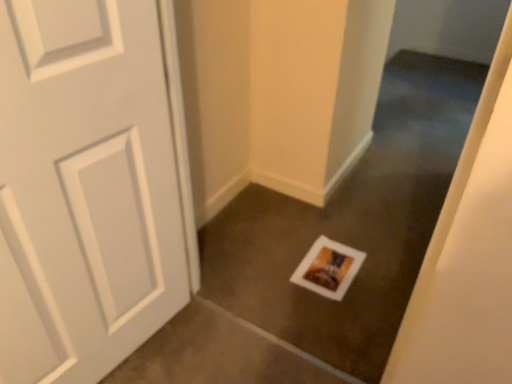
Question: Considering the positions of point (333, 291) and point (353, 205), is point (333, 291) closer or farther from the camera than point (353, 205)?

Choices:
 (A) closer
 (B) farther

Answer: (A)

Question: Considering the relative positions of white matte postcard at center and white matte picture frame at center in the image provided, is white matte postcard at center to the left or to the right of white matte picture frame at center?

Choices:
 (A) left
 (B) right

Answer: (B)

Question: In the image, is white matte postcard at center positioned in front of or behind white matte picture frame at center?

Choices:
 (A) behind
 (B) front

Answer: (A)

Question: Based on their sizes in the image, would you say white matte picture frame at center is bigger or smaller than white matte postcard at center?

Choices:
 (A) big
 (B) small

Answer: (A)

Question: Considering the positions of point (257, 198) and point (301, 274), is point (257, 198) closer or farther from the camera than point (301, 274)?

Choices:
 (A) farther
 (B) closer

Answer: (A)

Question: Considering their positions, is white matte picture frame at center located in front of or behind white matte postcard at center?

Choices:
 (A) behind
 (B) front

Answer: (B)

Question: Based on their positions, is white matte picture frame at center located to the left or right of white matte postcard at center?

Choices:
 (A) right
 (B) left

Answer: (B)